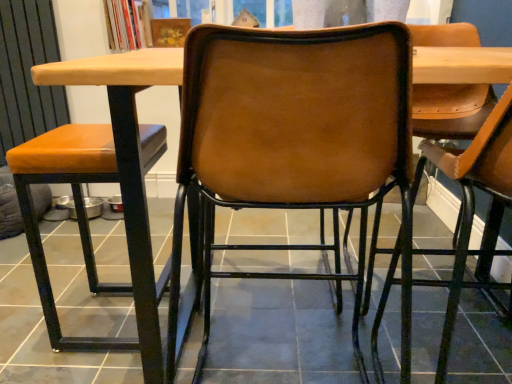
Question: Would you say orange leather stool at left, the 3th chair viewed from the right, is outside matte brown tile at center?

Choices:
 (A) no
 (B) yes

Answer: (B)

Question: Could matte brown tile at center be considered to be inside orange leather stool at left, which is the 1th chair from left to right?

Choices:
 (A) no
 (B) yes

Answer: (A)

Question: Can you confirm if orange leather stool at left, the 3th chair viewed from the right, is taller than matte brown tile at center?

Choices:
 (A) no
 (B) yes

Answer: (B)

Question: Considering the relative sizes of orange leather stool at left, which is the 1th chair from left to right, and matte brown tile at center in the image provided, is orange leather stool at left, which is the 1th chair from left to right, thinner than matte brown tile at center?

Choices:
 (A) no
 (B) yes

Answer: (B)

Question: From the image's perspective, is orange leather stool at left, which is the 1th chair from left to right, located beneath matte brown tile at center?

Choices:
 (A) no
 (B) yes

Answer: (A)

Question: Considering the relative sizes of orange leather stool at left, the 3th chair viewed from the right, and matte brown tile at center in the image provided, is orange leather stool at left, the 3th chair viewed from the right, bigger than matte brown tile at center?

Choices:
 (A) yes
 (B) no

Answer: (B)

Question: Is leather-like brown chair at center, acting as the third chair starting from the left, located outside orange leather stool at left, which is the 1th chair from left to right?

Choices:
 (A) no
 (B) yes

Answer: (B)

Question: Is leather-like brown chair at center, marked as the 1th chair in a right-to-left arrangement, thinner than orange leather stool at left, the 3th chair viewed from the right?

Choices:
 (A) no
 (B) yes

Answer: (A)

Question: Is leather-like brown chair at center, marked as the 1th chair in a right-to-left arrangement, far from orange leather stool at left, which is the 1th chair from left to right?

Choices:
 (A) yes
 (B) no

Answer: (B)

Question: Does leather-like brown chair at center, acting as the third chair starting from the left, have a larger size compared to orange leather stool at left, the 3th chair viewed from the right?

Choices:
 (A) yes
 (B) no

Answer: (A)

Question: From a real-world perspective, is leather-like brown chair at center, marked as the 1th chair in a right-to-left arrangement, below orange leather stool at left, the 3th chair viewed from the right?

Choices:
 (A) yes
 (B) no

Answer: (B)

Question: Is leather-like brown chair at center, marked as the 1th chair in a right-to-left arrangement, to the right of orange leather stool at left, the 3th chair viewed from the right, from the viewer's perspective?

Choices:
 (A) yes
 (B) no

Answer: (A)

Question: Considering the relative positions of leather-like brown chair at center, acting as the third chair starting from the left, and brown leather chair at center, which is the 2th chair from right to left, in the image provided, is leather-like brown chair at center, acting as the third chair starting from the left, in front of brown leather chair at center, which is the 2th chair from right to left,?

Choices:
 (A) yes
 (B) no

Answer: (A)